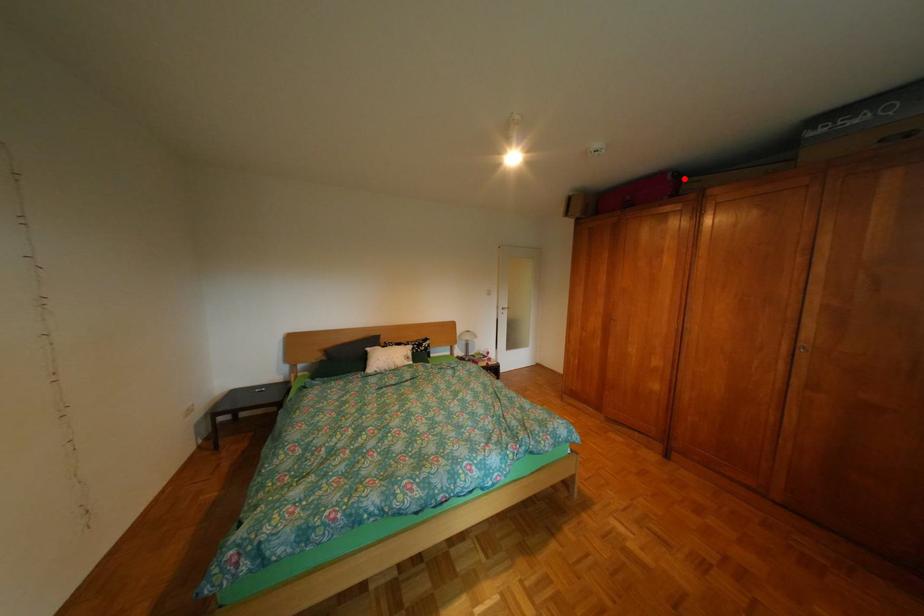
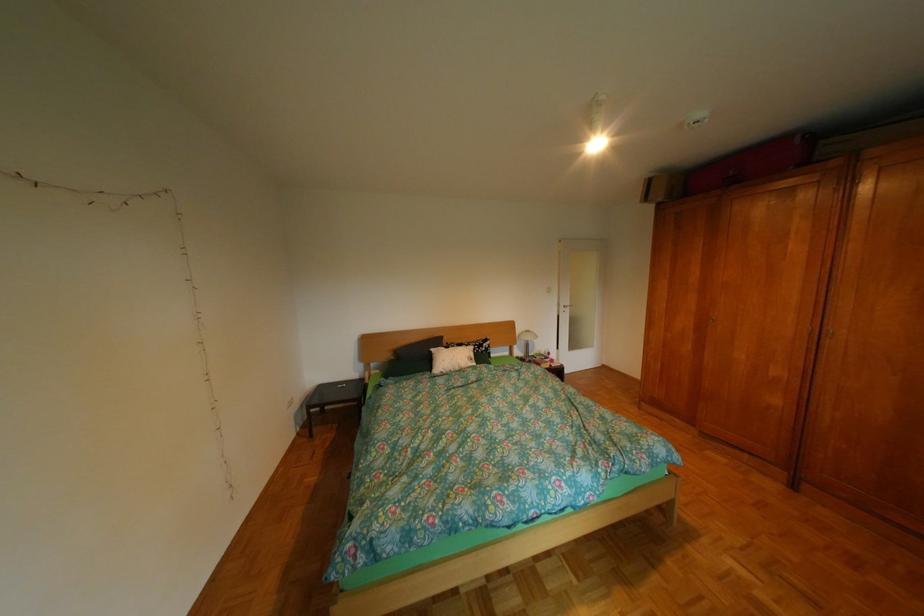
Where in the second image is the point corresponding to the highlighted location from the first image?

(812, 142)